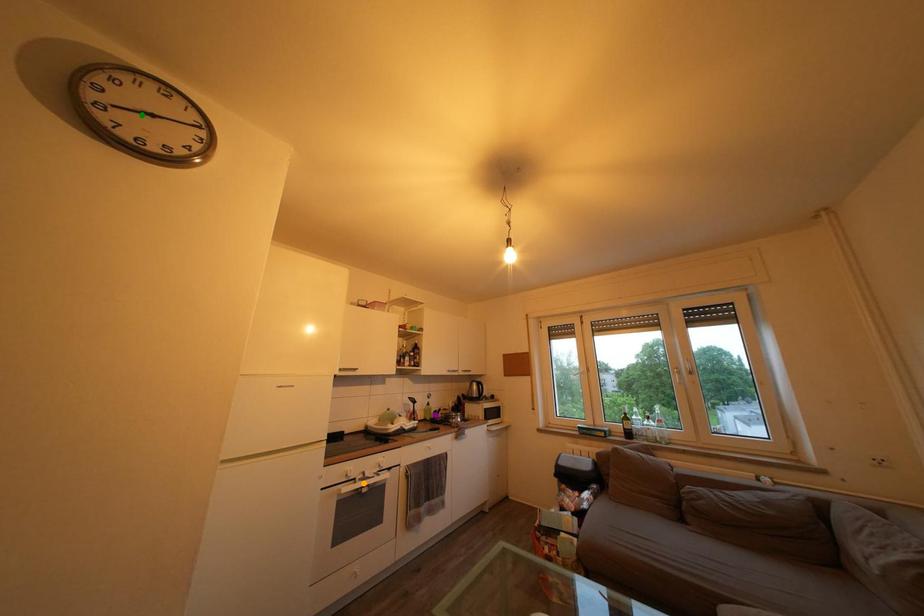
Order these from farthest to nearest:
purple point, green point, orange point

1. purple point
2. orange point
3. green point